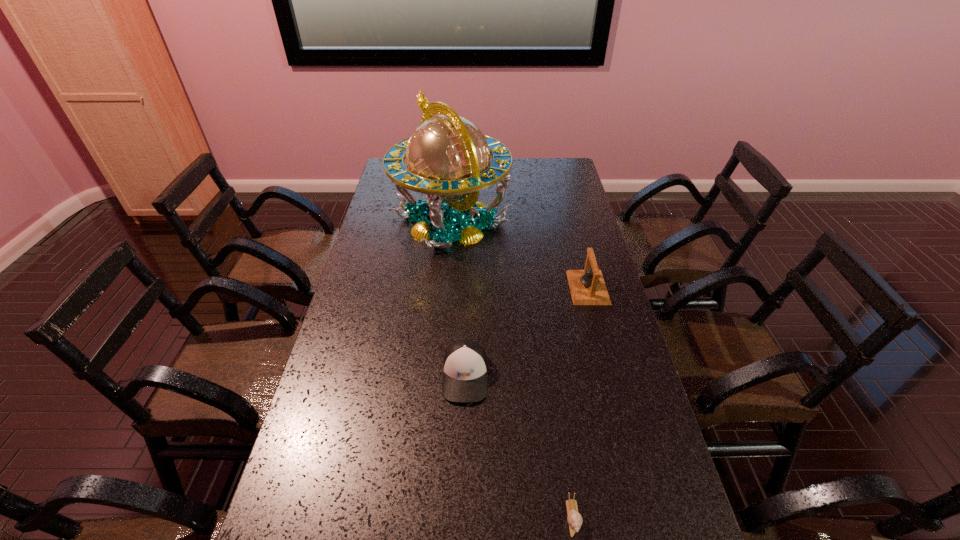
Image resolution: width=960 pixels, height=540 pixels. In order to click on vacant area located 0.250m on the front panel of the second nearest object in this screenshot , I will do `click(462, 506)`.

At what (x,y) coordinates should I click in order to perform the action: click on object at the left edge. Please return your answer as a coordinate pair (x, y). The width and height of the screenshot is (960, 540). Looking at the image, I should click on coord(448,158).

Where is `object at the right edge`? object at the right edge is located at coordinates (587, 287).

Image resolution: width=960 pixels, height=540 pixels. Identify the location of free space at the right edge. (603, 404).

This screenshot has width=960, height=540. Identify the location of vacant region at the far right corner of the desktop. (565, 169).

Locate an element on the screen. The width and height of the screenshot is (960, 540). vacant area that lies between the cap and the rightmost object is located at coordinates (527, 332).

Find the location of a particular element. free space between the third tallest object and the second tallest object is located at coordinates (527, 332).

Locate an element on the screen. free space between the cap and the shortest object is located at coordinates (519, 446).

Identify the location of free space between the second object from right to left and the cap. (519, 446).

Identify the location of free spot between the escargot and the tallest object. The image size is (960, 540). (512, 369).